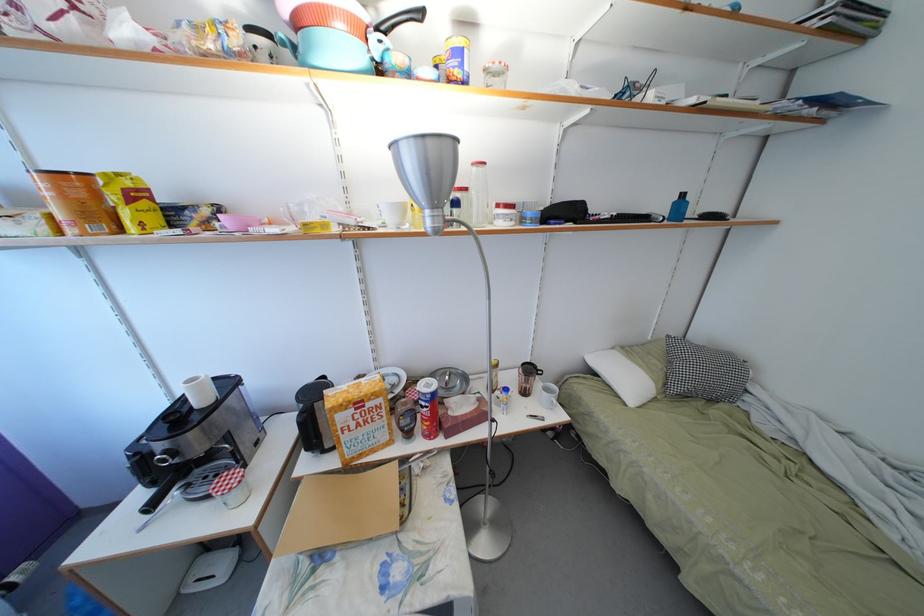
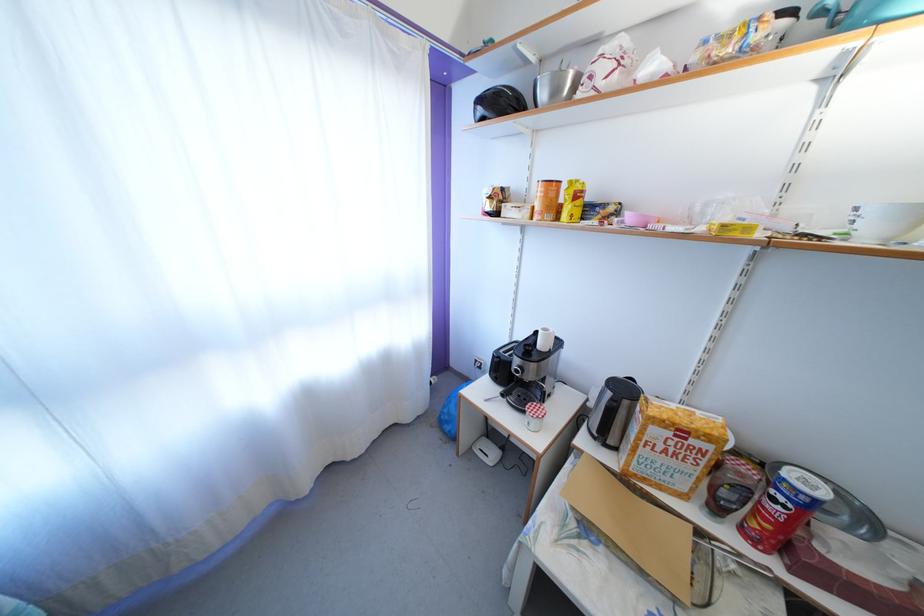
Locate, in the second image, the point that corresponds to [390,223] in the first image.

(862, 232)